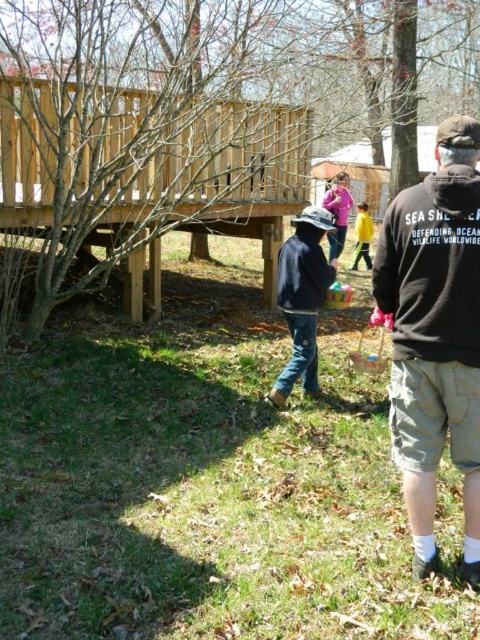
You are standing on the wooden deck looking towards the tree. There are two points marked in the scene. The first point is at coordinates point (304, 305) and the second is at point (375, 356). Which point is closer to you?

Point (304, 305) is closer to the camera than point (375, 356).

You are organizing a picnic in the backyard and have placed a denim jacket at center and a pink fabric basket at center. You need to know if the distance between them is more than 1 meter to ensure there is enough space for other items. Can you confirm?

The distance between the denim jacket at center and the pink fabric basket at center is 89.78 centimeters, which is less than 1 meter. Therefore, there isn not enough space between them for other items.

Looking at this image, you are standing on the wooden deck and want to pick up the black fleece sweatshirt at right. Which direction should you move to reach it?

The black fleece sweatshirt at right is located at point [432,268], so you should move to the right side of the wooden deck to reach it.